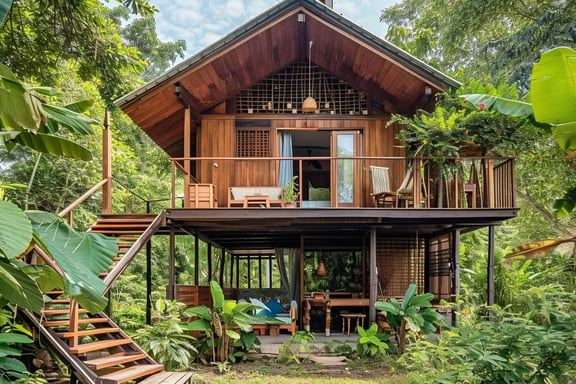
Find the location of a particular element. wood floor is located at coordinates (309, 213).